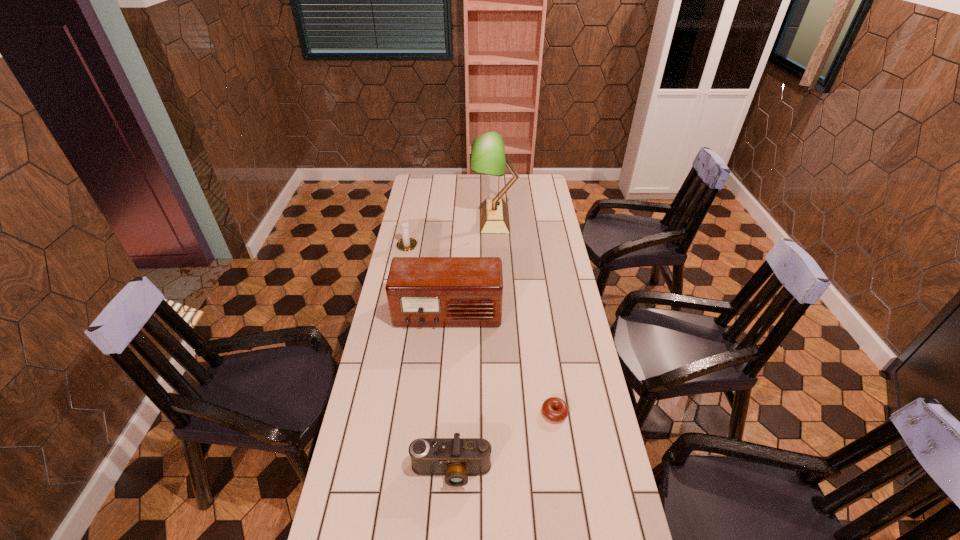
In order to click on the farthest object in this screenshot , I will do `click(488, 157)`.

Where is `table lamp`? The height and width of the screenshot is (540, 960). table lamp is located at coordinates (488, 157).

In order to click on radio receiver in this screenshot , I will do `click(421, 291)`.

Locate an element on the screen. The width and height of the screenshot is (960, 540). the third nearest object is located at coordinates (421, 291).

You are a GUI agent. You are given a task and a screenshot of the screen. Output one action in this format:
    pyautogui.click(x=<x>, y=<y>)
    Task: Click on the candle holder
    The image size is (960, 540).
    Given the screenshot: What is the action you would take?
    pyautogui.click(x=405, y=244)

Where is `the fourth nearest object`? This screenshot has width=960, height=540. the fourth nearest object is located at coordinates point(405,244).

Where is `the nearest object`? The width and height of the screenshot is (960, 540). the nearest object is located at coordinates (456, 458).

Where is `the fourth tallest object`? The width and height of the screenshot is (960, 540). the fourth tallest object is located at coordinates (456, 458).

The image size is (960, 540). In order to click on the shortest object in this screenshot , I will do `click(548, 406)`.

Locate an element on the screen. Image resolution: width=960 pixels, height=540 pixels. doughnut is located at coordinates (548, 406).